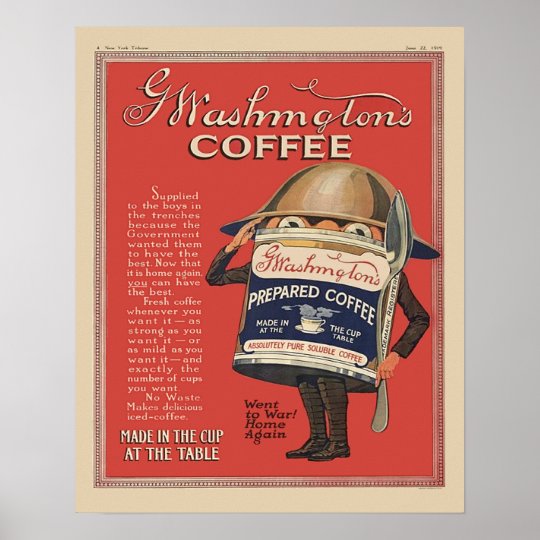
This screenshot has width=540, height=540. Identify the location of coffee cup. (308, 320).